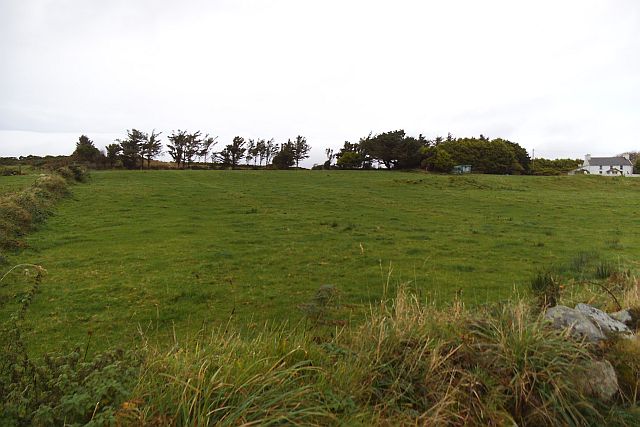
Identify the location of window. (603, 167).